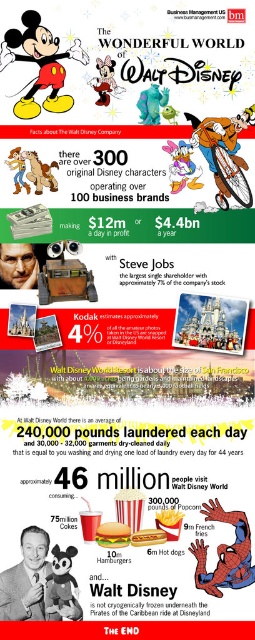
Between point (15, 104) and point (95, 77), which one is positioned behind?

The point (95, 77) is more distant.

Between matte red shorts at center and pastel pink paper at center, which one has less height?

pastel pink paper at center

Describe the element at coordinates (40, 64) in the screenshot. I see `matte red shorts at center` at that location.

This screenshot has width=255, height=640. In order to click on matte red shorts at center in this screenshot , I will do `click(40, 64)`.

In the scene shown: Who is more distant from viewer, (45, 65) or (210, 579)?

Point (45, 65)

Which is behind, point (4, 67) or point (241, 540)?

Positioned behind is point (241, 540).

Find the location of a particular element. The width and height of the screenshot is (255, 640). matte red shorts at center is located at coordinates (40, 64).

Can you confirm if matte black spider-man at center is positioned to the left of pastel pink paper at center?

In fact, matte black spider-man at center is to the right of pastel pink paper at center.

Is matte black spider-man at center wider than pastel pink paper at center?

Yes, matte black spider-man at center is wider than pastel pink paper at center.

What do you see at coordinates (224, 554) in the screenshot?
I see `matte black spider-man at center` at bounding box center [224, 554].

Identify the location of matte black spider-man at center. pyautogui.click(x=224, y=554).